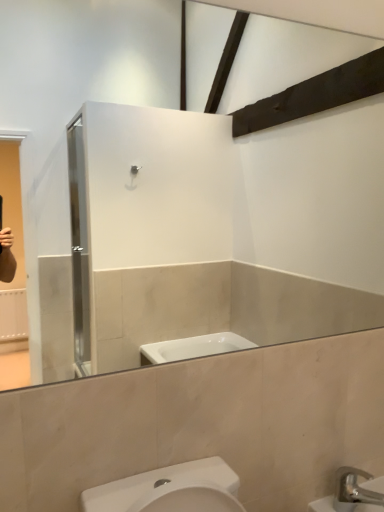
In order to click on white ceramic sink at lower right in this screenshot , I will do `click(352, 493)`.

The image size is (384, 512). What do you see at coordinates (352, 493) in the screenshot? I see `white ceramic sink at lower right` at bounding box center [352, 493].

Find the location of `white ceramic sink at lower right`. white ceramic sink at lower right is located at coordinates (352, 493).